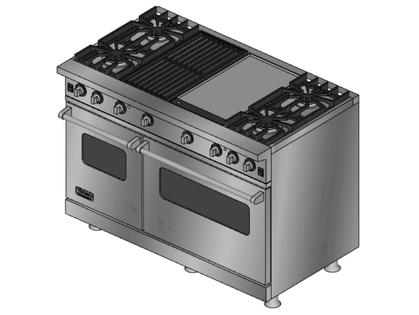
Find the location of a particular element. The height and width of the screenshot is (315, 419). handle for oven on right is located at coordinates (206, 179).